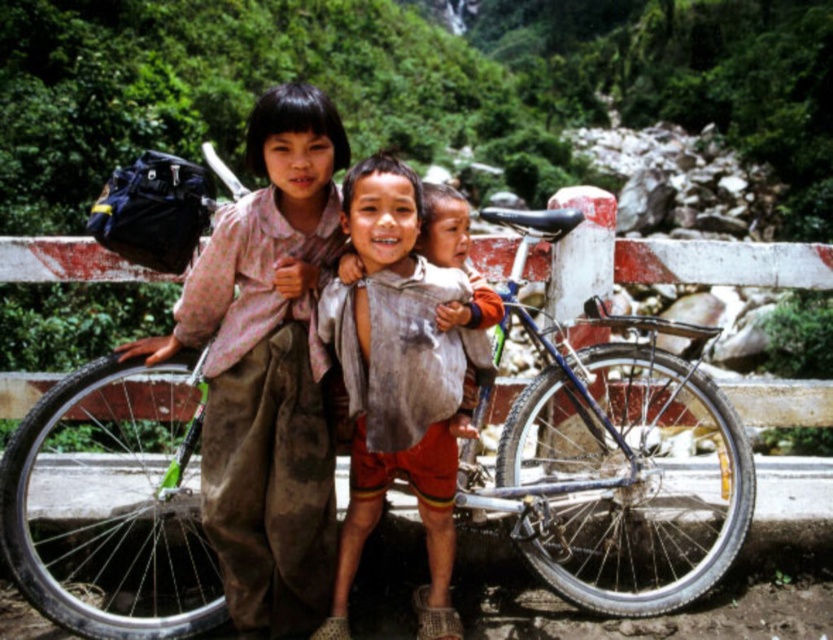
You are standing at the starting point of the bridge. You want to reach the blue metallic bicycle at center. Which direction should you move in to get there?

Since the blue metallic bicycle at center is located at point (616, 476), you should move towards the center of the bridge to reach it.

Looking at this image, you are a delivery person who needs to transport a large package that requires a space wider than the rusty metal bicycle at center. Can the white painted wood fence at center accommodate the package?

The rusty metal bicycle at center is narrower than the white painted wood fence at center, so the fence can accommodate the package as it is wider than the bicycle.